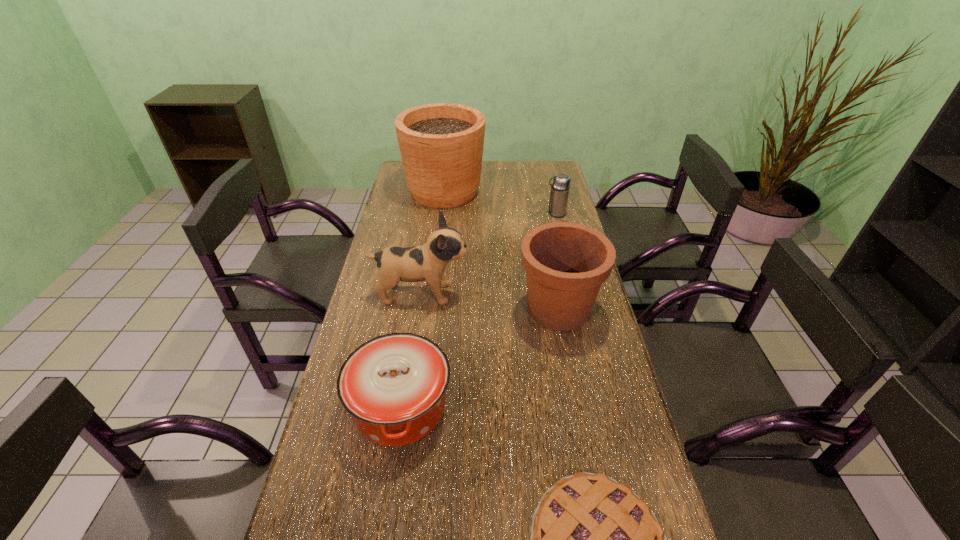
Point out which object is positioned as the second nearest to the nearest object. Please provide its 2D coordinates. Your answer should be formatted as a tuple, i.e. [(x, y)], where the tuple contains the x and y coordinates of a point satisfying the conditions above.

[(566, 263)]

This screenshot has width=960, height=540. Find the location of `vacant space that satisfies the following two spatial constraints: 1. at the face of the puppy; 2. on the right side of the shorter flowerpot`. vacant space that satisfies the following two spatial constraints: 1. at the face of the puppy; 2. on the right side of the shorter flowerpot is located at coordinates (419, 309).

Locate an element on the screen. vacant region that satisfies the following two spatial constraints: 1. on the back side of the left flowerpot; 2. on the right side of the casserole is located at coordinates (434, 191).